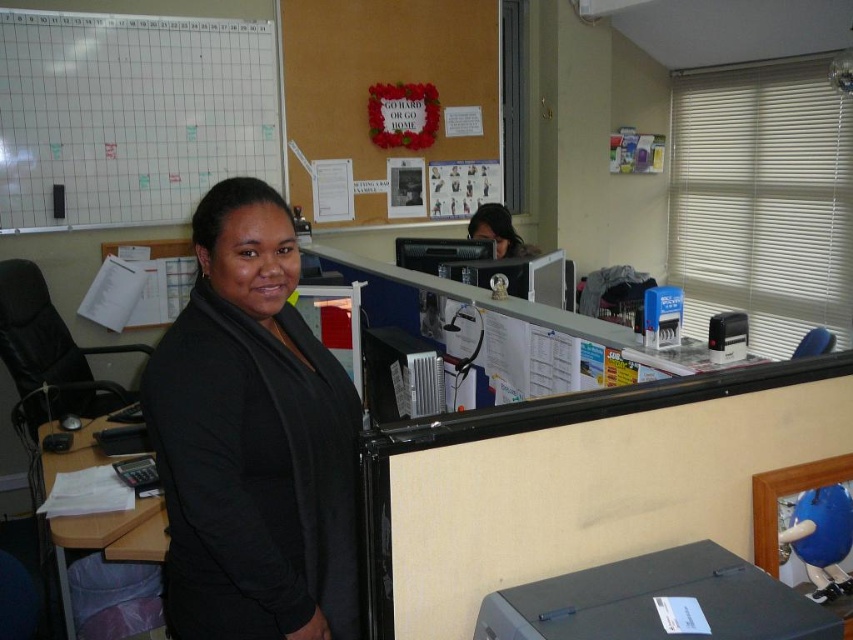
Question: Considering the relative positions of black matte jacket at center and matte black hair at upper center in the image provided, where is black matte jacket at center located with respect to matte black hair at upper center?

Choices:
 (A) above
 (B) below

Answer: (B)

Question: Estimate the real-world distances between objects in this image. Which object is farther from the black matte printer at lower right?

Choices:
 (A) wooden desk at lower left
 (B) white grid paper at upper left
 (C) black plastic computer at center
 (D) black matte jacket at center

Answer: (B)

Question: Does black plastic computer at center come behind wooden desk at lower left?

Choices:
 (A) yes
 (B) no

Answer: (A)

Question: Which point appears closest to the camera in this image?

Choices:
 (A) (57, 108)
 (B) (495, 237)

Answer: (A)

Question: Does black matte printer at lower right come in front of wooden desk at lower left?

Choices:
 (A) yes
 (B) no

Answer: (A)

Question: Which object is positioned closest to the black plastic computer at center?

Choices:
 (A) matte black hair at upper center
 (B) black matte printer at lower right
 (C) white grid paper at upper left

Answer: (A)